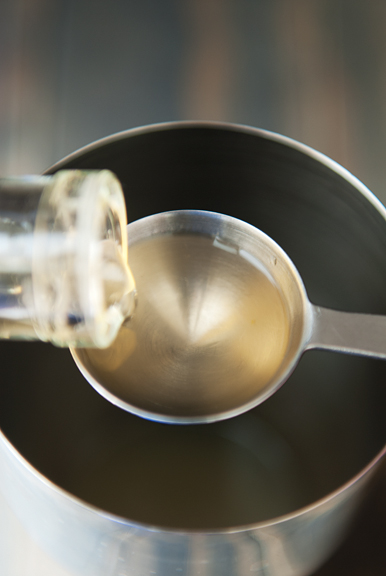
This screenshot has width=386, height=576. Find the location of `bottle`. bottle is located at coordinates (15, 214).